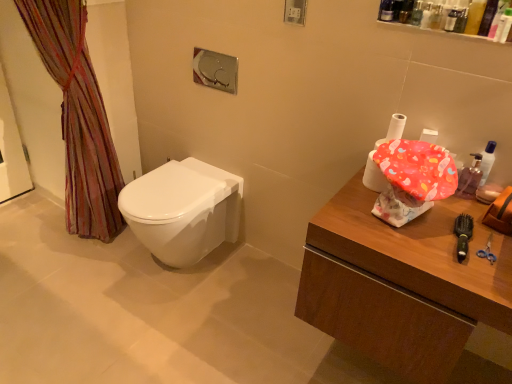
Identify the location of vacant area that is situated to the right of white glossy toilet at center. This screenshot has height=384, width=512. (250, 283).